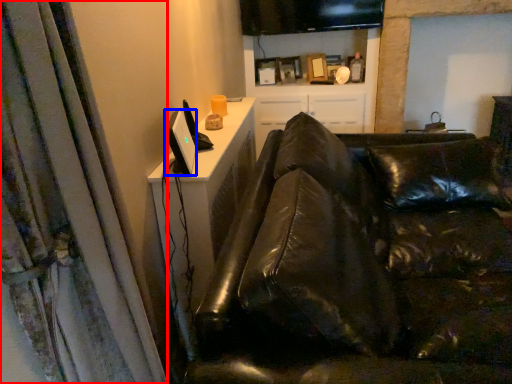
Question: Which point is closer to the camera, curtain (highlighted by a red box) or computer monitor (highlighted by a blue box)?

Choices:
 (A) curtain
 (B) computer monitor

Answer: (A)